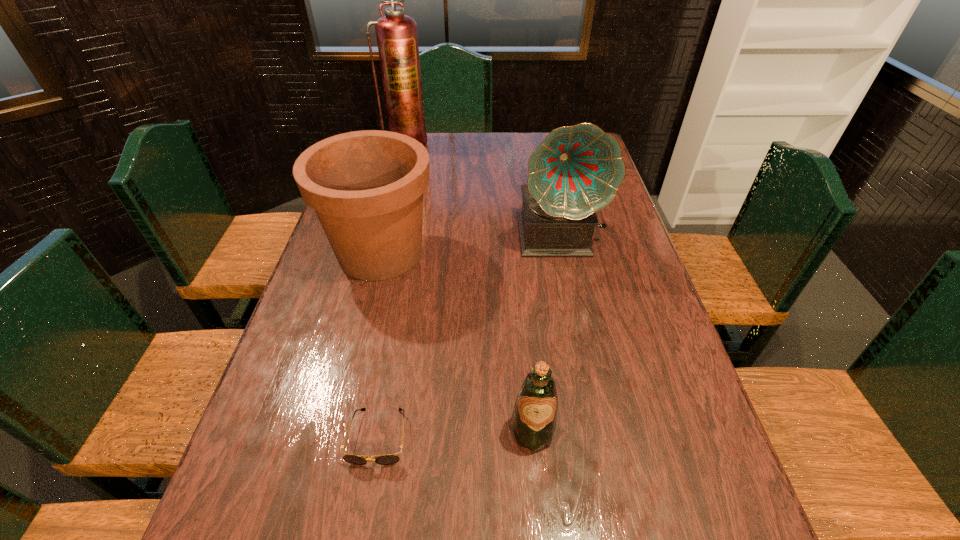
At what (x,y) coordinates should I click in order to perform the action: click on fire extinguisher. Please return your answer as a coordinate pair (x, y). This screenshot has width=960, height=540. Looking at the image, I should click on click(397, 39).

Find the location of a particular element. This screenshot has height=540, width=960. the farthest object is located at coordinates (397, 39).

Where is `record player`? This screenshot has width=960, height=540. record player is located at coordinates (576, 171).

Find the location of a particular element. This screenshot has height=540, width=960. flowerpot is located at coordinates (366, 187).

Locate an element on the screen. The width and height of the screenshot is (960, 540). the second shortest object is located at coordinates (533, 422).

The height and width of the screenshot is (540, 960). I want to click on sunglasses, so click(388, 459).

Locate an element on the screen. The height and width of the screenshot is (540, 960). vacant space situated 0.310m on the side of the tallest object with the label is located at coordinates (393, 200).

Locate an element on the screen. This screenshot has width=960, height=540. vacant space located 0.090m on the horn of the fourth shortest object is located at coordinates (569, 287).

Where is `blank area located on the front of the flowerpot`? This screenshot has width=960, height=540. blank area located on the front of the flowerpot is located at coordinates (351, 370).

You are a GUI agent. You are given a task and a screenshot of the screen. Output one action in this format:
    pyautogui.click(x=<x>, y=<y>)
    Task: Click on the blank space located on the front-facing side of the fourth tallest object
    
    Given the screenshot: What is the action you would take?
    pyautogui.click(x=539, y=503)